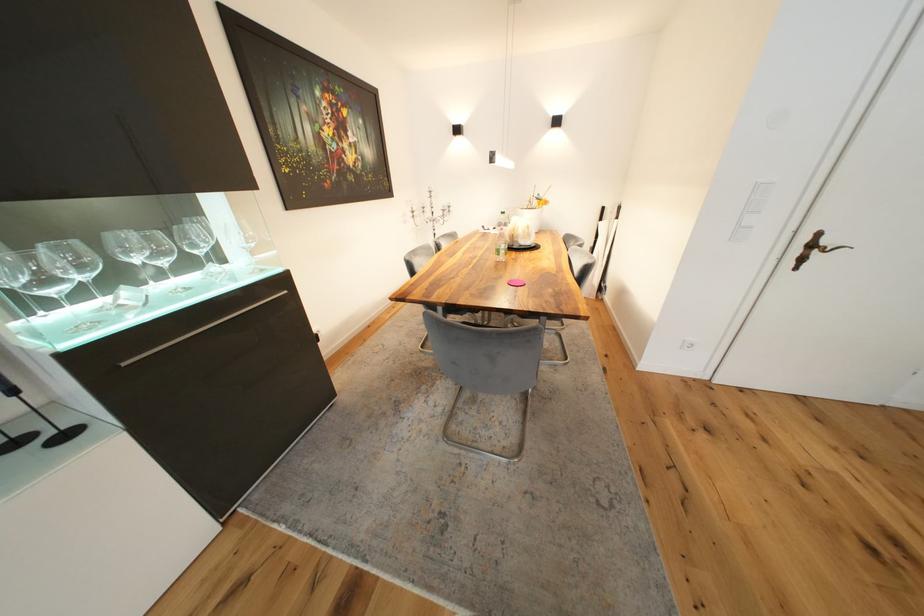
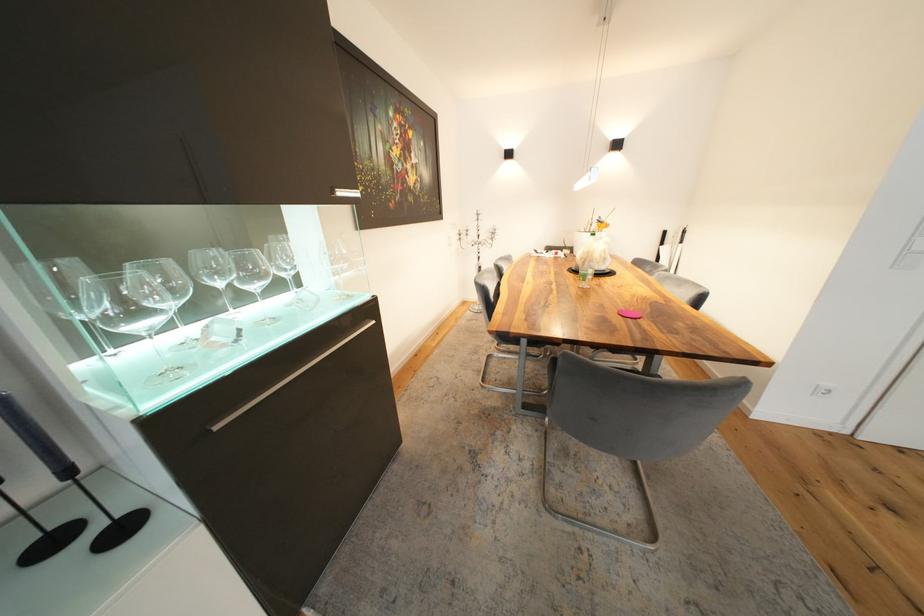
Locate, in the second image, the point that corresponds to [138,259] in the first image.

(222, 282)